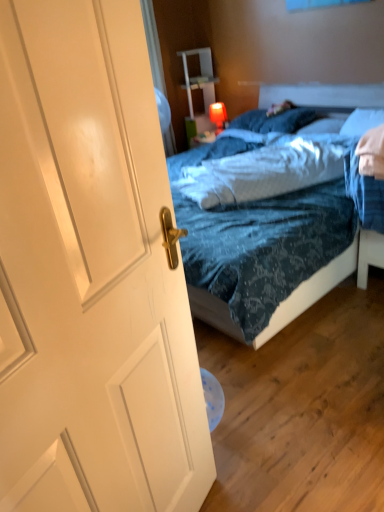
Question: Based on their positions, is blue textured bedsheet at center located to the left or right of blue textured pillow at center, which ranks as the third pillow in right-to-left order?

Choices:
 (A) left
 (B) right

Answer: (A)

Question: Does point (208, 181) appear closer or farther from the camera than point (258, 131)?

Choices:
 (A) farther
 (B) closer

Answer: (B)

Question: Which of these objects is positioned farthest from the blue textured bedsheet at center?

Choices:
 (A) white matte door at left
 (B) blue textured pillow at center, which ranks as the third pillow in right-to-left order
 (C) white soft pillow at upper center, the second pillow positioned from the left
 (D) white soft pillow at upper right, acting as the 1th pillow starting from the right

Answer: (A)

Question: Estimate the real-world distances between objects in this image. Which object is closer to the white matte door at left?

Choices:
 (A) white soft pillow at upper right, acting as the 1th pillow starting from the right
 (B) blue textured bedsheet at center
 (C) white soft pillow at upper center, which appears as the 2th pillow when viewed from the right
 (D) blue textured pillow at center, the 1th pillow in the left-to-right sequence

Answer: (B)